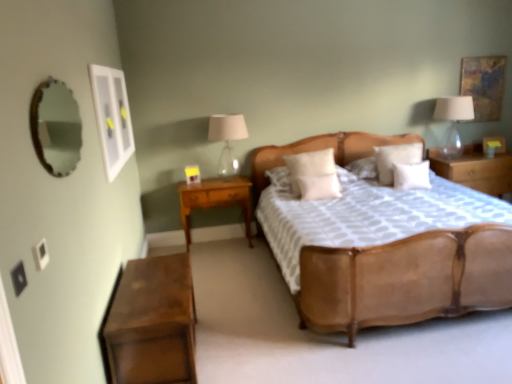
Describe the element at coordinates (112, 117) in the screenshot. I see `white glossy picture frame at upper left, arranged as the 2th picture frame when viewed from the right` at that location.

Locate an element on the screen. white soft pillow at center, placed as the 3th pillow when sorted from left to right is located at coordinates (395, 159).

Measure the distance from matte glass lampshade at center, the second bedside lamp in the right-to-left sequence, to light wood/wooden nightstand at lower left, positioned as the 2th nightstand in left-to-right order.

matte glass lampshade at center, the second bedside lamp in the right-to-left sequence, is 62.01 centimeters from light wood/wooden nightstand at lower left, positioned as the 2th nightstand in left-to-right order.

Which point is more distant from viewer, [211,118] or [184,191]?

Point [211,118]

Is there a large distance between matte glass lampshade at center, the second bedside lamp in the right-to-left sequence, and light wood/wooden nightstand at lower left, positioned as the 2th nightstand in left-to-right order?

No, matte glass lampshade at center, the second bedside lamp in the right-to-left sequence, is in close proximity to light wood/wooden nightstand at lower left, positioned as the 2th nightstand in left-to-right order.

Which object is positioned more to the right, matte glass lampshade at center, the second bedside lamp in the right-to-left sequence, or light wood/wooden nightstand at lower left, the second nightstand when ordered from right to left?

matte glass lampshade at center, the second bedside lamp in the right-to-left sequence.

Which of these two, white soft pillow at center, which ranks as the 1th pillow in left-to-right order, or wooden nightstand at lower left, which ranks as the 1th nightstand in left-to-right order, stands shorter?

Standing shorter between the two is wooden nightstand at lower left, which ranks as the 1th nightstand in left-to-right order.

From a real-world perspective, is white soft pillow at center, the fourth pillow in the right-to-left sequence, on top of wooden nightstand at lower left, the 1th nightstand when ordered from front to back?

Indeed, from a real-world perspective, white soft pillow at center, the fourth pillow in the right-to-left sequence, stands above wooden nightstand at lower left, the 1th nightstand when ordered from front to back.

From the image's perspective, is white soft pillow at center, the fourth pillow in the right-to-left sequence, located above wooden nightstand at lower left, the third nightstand from the right?

Yes, from the image's perspective, white soft pillow at center, the fourth pillow in the right-to-left sequence, is on top of wooden nightstand at lower left, the third nightstand from the right.

Is white soft pillow at center, placed as the 3th pillow when sorted from left to right, inside translucent glass lampshade at right, which is counted as the 2th bedside lamp, starting from the left?

Definitely not — white soft pillow at center, placed as the 3th pillow when sorted from left to right, is not inside translucent glass lampshade at right, which is counted as the 2th bedside lamp, starting from the left.

In terms of width, does translucent glass lampshade at right, which is counted as the 2th bedside lamp, starting from the left, look wider or thinner when compared to white soft pillow at center, placed as the 3th pillow when sorted from left to right?

translucent glass lampshade at right, which is counted as the 2th bedside lamp, starting from the left, is wider than white soft pillow at center, placed as the 3th pillow when sorted from left to right.

Is translucent glass lampshade at right, which is counted as the 1th bedside lamp, starting from the right, oriented away from white soft pillow at center, placed as the 3th pillow when sorted from left to right?

No, translucent glass lampshade at right, which is counted as the 1th bedside lamp, starting from the right,'s orientation is not away from white soft pillow at center, placed as the 3th pillow when sorted from left to right.

Is point (454, 107) closer or farther from the camera than point (384, 181)?

Point (454, 107) appears to be farther away from the viewer than point (384, 181).

Is textured canvas painting at upper right, the 2th picture frame from the front, positioned with its back to wooden mirror at upper left?

That's not correct — textured canvas painting at upper right, the 2th picture frame from the front, is not looking away from wooden mirror at upper left.

Does textured canvas painting at upper right, which is counted as the 2th picture frame, starting from the bottom, have a larger size compared to wooden mirror at upper left?

No, textured canvas painting at upper right, which is counted as the 2th picture frame, starting from the bottom, is not bigger than wooden mirror at upper left.

Is textured canvas painting at upper right, the 2th picture frame from the front, not near wooden mirror at upper left?

Yes, textured canvas painting at upper right, the 2th picture frame from the front, and wooden mirror at upper left are located far from each other.

Considering the positions of objects textured canvas painting at upper right, marked as the first picture frame in a top-to-bottom arrangement, and wooden mirror at upper left in the image provided, who is more to the right, textured canvas painting at upper right, marked as the first picture frame in a top-to-bottom arrangement, or wooden mirror at upper left?

Positioned to the right is textured canvas painting at upper right, marked as the first picture frame in a top-to-bottom arrangement.

Which object is thinner, light wood/wooden nightstand at lower left, the second nightstand when ordered from back to front, or white soft pillow at center, marked as the 2th pillow in a right-to-left arrangement?

Thinner between the two is white soft pillow at center, marked as the 2th pillow in a right-to-left arrangement.

Does light wood/wooden nightstand at lower left, positioned as the 2th nightstand in left-to-right order, turn towards white soft pillow at center, placed as the 3th pillow when sorted from left to right?

No.

What's the angular difference between light wood/wooden nightstand at lower left, the second nightstand when ordered from back to front, and white soft pillow at center, placed as the 3th pillow when sorted from left to right,'s facing directions?

light wood/wooden nightstand at lower left, the second nightstand when ordered from back to front, and white soft pillow at center, placed as the 3th pillow when sorted from left to right, are facing 1.14 degrees away from each other.

From a real-world perspective, relative to white soft pillow at center, marked as the 2th pillow in a right-to-left arrangement, is light wood/wooden nightstand at lower left, the 2th nightstand viewed from the front, vertically above or below?

From a real-world perspective, light wood/wooden nightstand at lower left, the 2th nightstand viewed from the front, is physically below white soft pillow at center, marked as the 2th pillow in a right-to-left arrangement.

Which is further, [237,166] or [473,145]?

The point [473,145] is more distant.

Consider the image. From the image's perspective, between matte glass lampshade at center, the first bedside lamp viewed from the left, and wooden nightstand at right, positioned as the 1th nightstand in back-to-front order, who is located below?

From the image's view, wooden nightstand at right, positioned as the 1th nightstand in back-to-front order, is below.

Can you confirm if matte glass lampshade at center, the first bedside lamp viewed from the left, is positioned to the left of wooden nightstand at right, the 3th nightstand positioned from the left?

Correct, you'll find matte glass lampshade at center, the first bedside lamp viewed from the left, to the left of wooden nightstand at right, the 3th nightstand positioned from the left.

From a real-world perspective, relative to wooden nightstand at right, the 3th nightstand positioned from the left, is matte glass lampshade at center, the first bedside lamp viewed from the left, vertically above or below?

In terms of real-world spatial position, matte glass lampshade at center, the first bedside lamp viewed from the left, is above wooden nightstand at right, the 3th nightstand positioned from the left.

Which is behind, matte glass lampshade at center, the second bedside lamp in the right-to-left sequence, or leather bed at center?

Positioned behind is matte glass lampshade at center, the second bedside lamp in the right-to-left sequence.

Between matte glass lampshade at center, the first bedside lamp viewed from the left, and leather bed at center, which one has larger width?

leather bed at center is wider.

Does matte glass lampshade at center, the first bedside lamp viewed from the left, appear on the left side of leather bed at center?

Indeed, matte glass lampshade at center, the first bedside lamp viewed from the left, is positioned on the left side of leather bed at center.

From a real-world perspective, is matte glass lampshade at center, the first bedside lamp viewed from the left, below leather bed at center?

Incorrect, from a real-world perspective, matte glass lampshade at center, the first bedside lamp viewed from the left, is higher than leather bed at center.

Image resolution: width=512 pixels, height=384 pixels. What are the coordinates of `the 1st bedside lamp to the right of the light wood/wooden nightstand at lower left, positioned as the 2th nightstand in left-to-right order, counting from the anchor's position` in the screenshot? It's located at (227, 139).

Starting from the white soft pillow at center, which ranks as the 1th pillow in left-to-right order, which nightstand is the 2nd one to the left? Please provide its 2D coordinates.

[(153, 323)]

Looking at the image, which one is located further to textured canvas painting at upper right, marked as the first picture frame in a top-to-bottom arrangement, white soft pillow at center, the 4th pillow when ordered from left to right, or white soft pillow at center, which ranks as the 1th pillow in left-to-right order?

The object further to textured canvas painting at upper right, marked as the first picture frame in a top-to-bottom arrangement, is white soft pillow at center, which ranks as the 1th pillow in left-to-right order.

Based on their spatial positions, is light wood/wooden nightstand at lower left, the second nightstand when ordered from right to left, or matte glass lampshade at center, the second bedside lamp in the right-to-left sequence, closer to white soft pillow at center, marked as the 2th pillow in a right-to-left arrangement?

The object closer to white soft pillow at center, marked as the 2th pillow in a right-to-left arrangement, is matte glass lampshade at center, the second bedside lamp in the right-to-left sequence.

Looking at the image, which one is located closer to white soft pillow at center, the 4th pillow when ordered from left to right, white soft pillow at center, the third pillow viewed from the right, or wooden mirror at upper left?

white soft pillow at center, the third pillow viewed from the right, lies closer to white soft pillow at center, the 4th pillow when ordered from left to right, than the other object.

Based on their spatial positions, is wooden nightstand at right, the third nightstand when ordered from front to back, or white soft pillow at center, marked as the 2th pillow in a right-to-left arrangement, closer to translucent glass lampshade at right, which is counted as the 1th bedside lamp, starting from the right?

Among the two, wooden nightstand at right, the third nightstand when ordered from front to back, is located nearer to translucent glass lampshade at right, which is counted as the 1th bedside lamp, starting from the right.

Considering their positions, is light wood/wooden nightstand at lower left, the second nightstand when ordered from right to left, positioned closer to textured canvas painting at upper right, marked as the first picture frame in a top-to-bottom arrangement, than wooden mirror at upper left?

light wood/wooden nightstand at lower left, the second nightstand when ordered from right to left, is closer to textured canvas painting at upper right, marked as the first picture frame in a top-to-bottom arrangement.

When comparing their distances from translucent glass lampshade at right, which is counted as the 1th bedside lamp, starting from the right, does white soft pillow at center, arranged as the first pillow when viewed from the right, or white glossy picture frame at upper left, which appears as the 2th picture frame when viewed from the top, seem further?

white glossy picture frame at upper left, which appears as the 2th picture frame when viewed from the top, is further to translucent glass lampshade at right, which is counted as the 1th bedside lamp, starting from the right.

Based on their spatial positions, is wooden mirror at upper left or white soft pillow at center, the third pillow viewed from the right, closer to translucent glass lampshade at right, which is counted as the 2th bedside lamp, starting from the left?

white soft pillow at center, the third pillow viewed from the right, is closer to translucent glass lampshade at right, which is counted as the 2th bedside lamp, starting from the left.

Based on their spatial positions, is white soft pillow at center, placed as the 3th pillow when sorted from left to right, or wooden mirror at upper left further from wooden nightstand at lower left, which ranks as the 1th nightstand in left-to-right order?

The object further to wooden nightstand at lower left, which ranks as the 1th nightstand in left-to-right order, is white soft pillow at center, placed as the 3th pillow when sorted from left to right.

Locate an element on the screen. The width and height of the screenshot is (512, 384). bedside lamp between leather bed at center and white soft pillow at center, the fourth pillow in the right-to-left sequence, along the z-axis is located at coordinates (227, 139).

This screenshot has width=512, height=384. I want to click on nightstand located between wooden nightstand at lower left, the 1th nightstand when ordered from front to back, and wooden nightstand at right, the third nightstand when ordered from front to back, in the left-right direction, so click(215, 200).

Where is `bed between white glossy picture frame at upper left, arranged as the 2th picture frame when viewed from the right, and textured canvas painting at upper right, the 2th picture frame from the front, from left to right`? Image resolution: width=512 pixels, height=384 pixels. bed between white glossy picture frame at upper left, arranged as the 2th picture frame when viewed from the right, and textured canvas painting at upper right, the 2th picture frame from the front, from left to right is located at coordinates coord(405,279).

At what (x,y) coordinates should I click in order to perform the action: click on bed positioned between wooden mirror at upper left and white soft pillow at center, placed as the 3th pillow when sorted from left to right, from near to far. Please return your answer as a coordinate pair (x, y). The image size is (512, 384). Looking at the image, I should click on (405, 279).